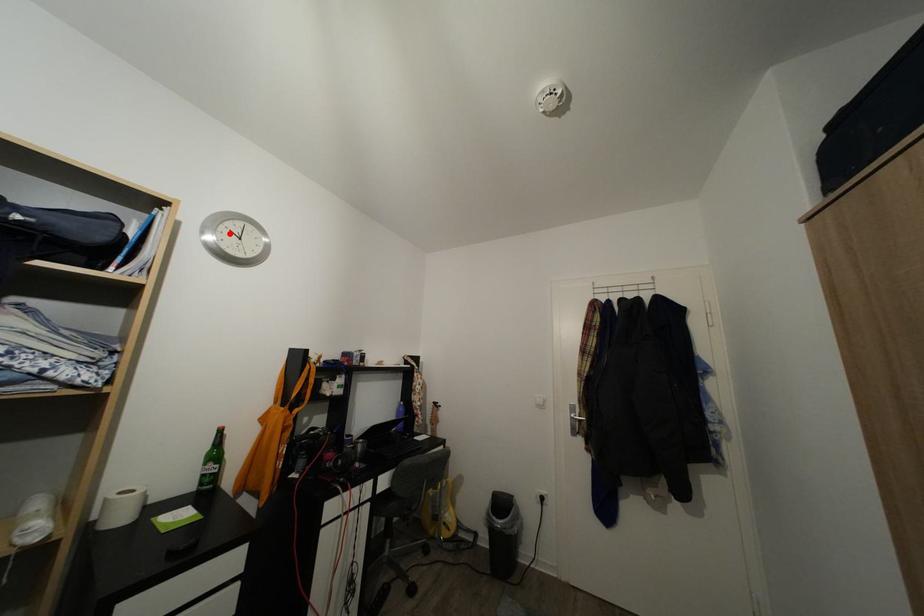
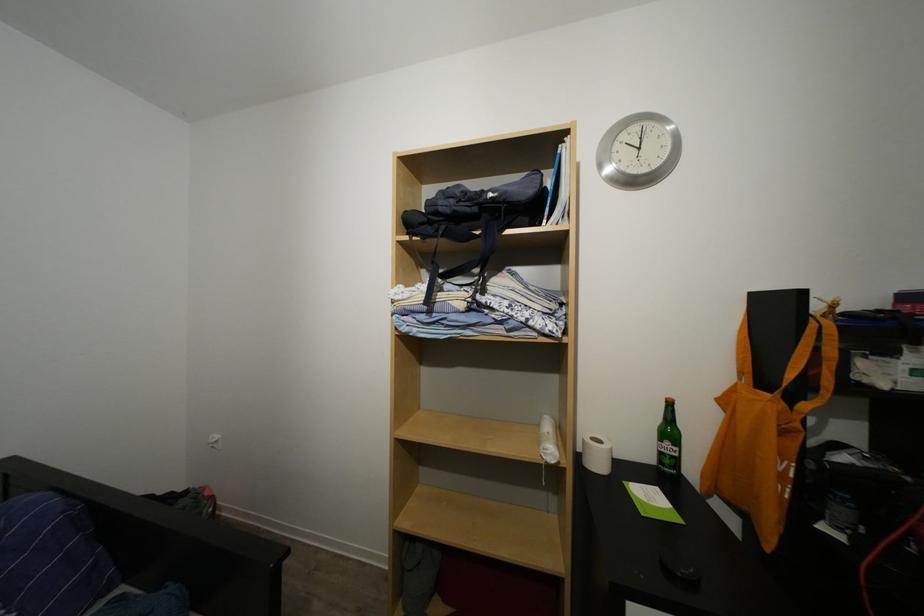
Where in the second image is the point corresponding to the highlighted location from the first image?

(625, 151)